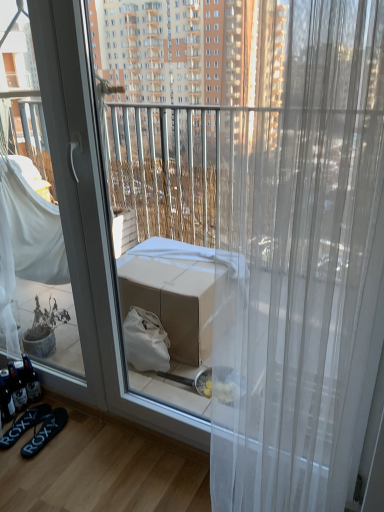
This screenshot has width=384, height=512. I want to click on free spot above black fabric flip-flops at lower left, placed as the first footwear when sorted from left to right (from a real-world perspective), so click(19, 420).